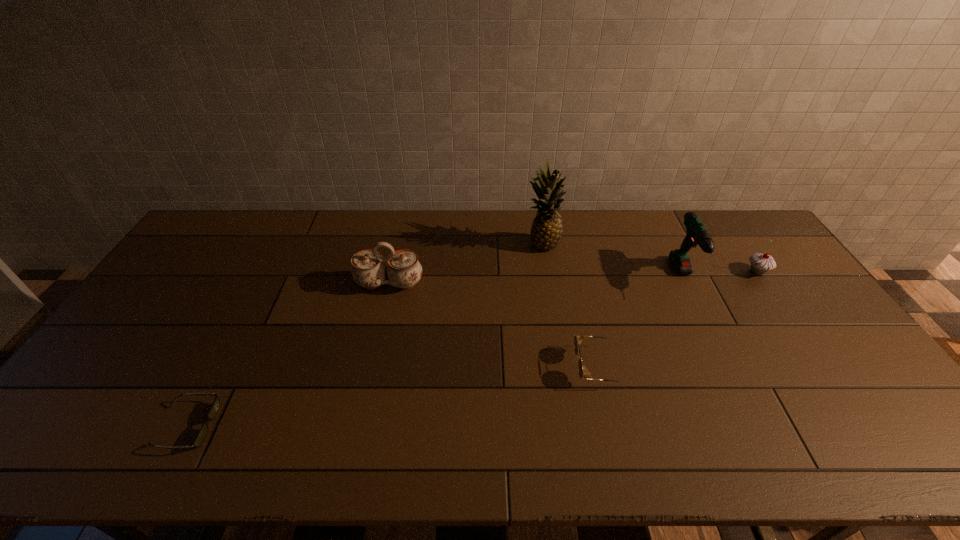
You are a GUI agent. You are given a task and a screenshot of the screen. Output one action in this format:
    pyautogui.click(x=<x>, y=<y>)
    Task: Click on the vacant space that is in between the rightmost object and the second tallest object
    The width and height of the screenshot is (960, 540).
    Given the screenshot: What is the action you would take?
    pyautogui.click(x=721, y=275)

Locate an element on the screen. This screenshot has width=960, height=540. free space between the second nearest object and the fourth tallest object is located at coordinates 678,319.

This screenshot has height=540, width=960. Identify the location of vacant point located between the pineapple and the shortest object. (364, 335).

The height and width of the screenshot is (540, 960). I want to click on free spot between the cupcake and the chinaware, so click(x=573, y=278).

In order to click on empty space that is in between the pineapple and the chinaware in this screenshot , I will do `click(466, 265)`.

This screenshot has height=540, width=960. I want to click on vacant space that is in between the fifth tallest object and the pineapple, so click(570, 306).

Locate which object ranks in proximity to the fifth object from right to left. Please provide its 2D coordinates. Your answer should be formatted as a tuple, i.e. [(x, y)], where the tuple contains the x and y coordinates of a point satisfying the conditions above.

[(546, 231)]

Image resolution: width=960 pixels, height=540 pixels. I want to click on object that can be found as the third closest to the leftmost object, so click(546, 231).

The width and height of the screenshot is (960, 540). Find the location of `free space that satisfies the following two spatial constraints: 1. by the handle of the third tallest object; 2. on the front-facing side of the nearest object`. free space that satisfies the following two spatial constraints: 1. by the handle of the third tallest object; 2. on the front-facing side of the nearest object is located at coordinates (359, 426).

You are a GUI agent. You are given a task and a screenshot of the screen. Output one action in this format:
    pyautogui.click(x=<x>, y=<y>)
    Task: Click on the free point that satisfies the following two spatial constraints: 1. by the handle of the chinaware; 2. on the front-facing side of the shorter sunglasses
    The image size is (960, 540).
    Given the screenshot: What is the action you would take?
    pyautogui.click(x=359, y=426)